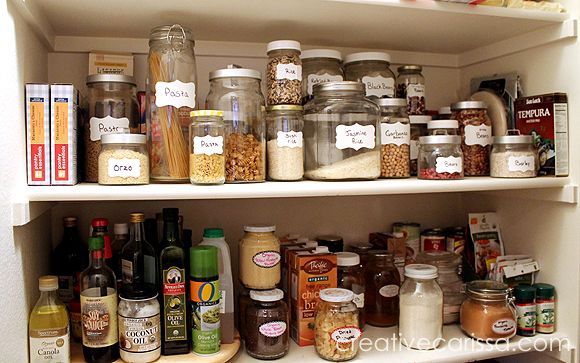
The width and height of the screenshot is (580, 363). Find the location of `bottled food items`. bottled food items is located at coordinates (44, 327), (83, 302), (97, 217), (74, 239), (125, 225), (136, 220), (153, 227), (174, 243), (182, 219), (215, 237).